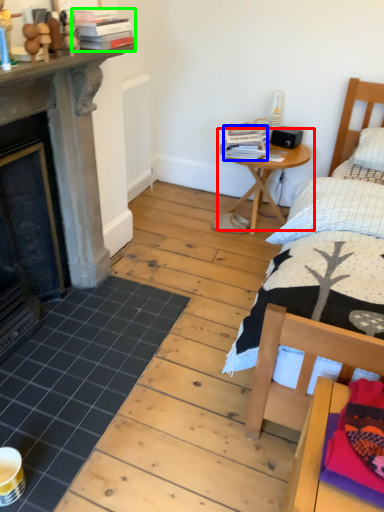
Question: Which is nearer to the table (highlighted by a red box)? book (highlighted by a blue box) or book (highlighted by a green box).

Choices:
 (A) book
 (B) book

Answer: (A)